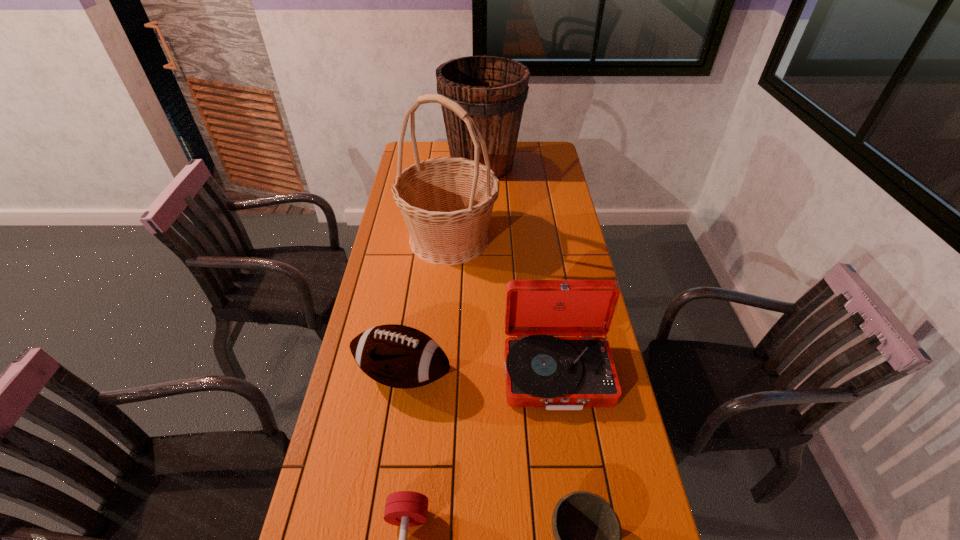
You are a GUI agent. You are given a task and a screenshot of the screen. Output one action in this format:
    pyautogui.click(x=<x>, y=<y>)
    Task: Click on the object that is at the far edge
    The height and width of the screenshot is (540, 960).
    Given the screenshot: What is the action you would take?
    pyautogui.click(x=493, y=90)

This screenshot has height=540, width=960. What are the coordinates of `basket situated at the left edge` in the screenshot? It's located at (446, 202).

Identify the location of football (American) at the left edge. (398, 356).

Find the location of a particular element. This screenshot has height=540, width=960. object located at the right edge is located at coordinates click(559, 373).

Image resolution: width=960 pixels, height=540 pixels. In the image, there is a desktop. Identify the location of vacant space at the left edge. (400, 266).

The height and width of the screenshot is (540, 960). In the image, there is a desktop. In order to click on vacant space at the right edge in this screenshot , I will do `click(539, 231)`.

Locate an element on the screen. The height and width of the screenshot is (540, 960). free space at the far left corner of the desktop is located at coordinates (432, 146).

This screenshot has width=960, height=540. In order to click on vacant space that's between the bucket and the third tallest object in this screenshot , I will do `click(519, 269)`.

The image size is (960, 540). Identify the location of vacant space in between the bucket and the phonograph_record. (519, 269).

Identify the location of vacant area that lies between the farthest object and the phonograph_record. (519, 269).